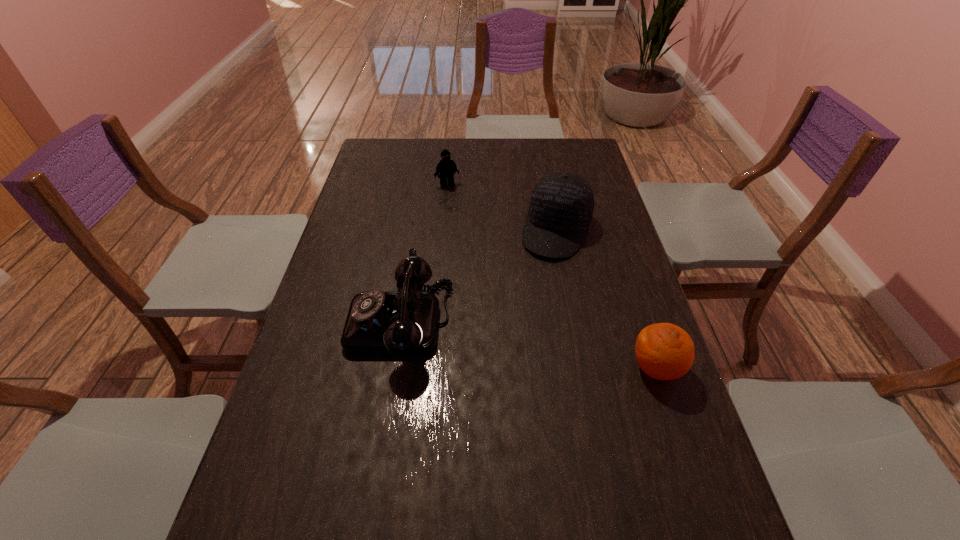
Locate an element on the screen. This screenshot has width=960, height=540. free spot at the far left corner of the desktop is located at coordinates (398, 168).

Image resolution: width=960 pixels, height=540 pixels. In order to click on vacant region at the far right corner in this screenshot , I will do `click(560, 166)`.

This screenshot has width=960, height=540. Identify the location of empty space that is in between the telephone and the farthest object. (423, 253).

The width and height of the screenshot is (960, 540). I want to click on empty space that is in between the baseball cap and the orange, so click(607, 299).

Locate an element on the screen. empty space between the baseball cap and the farthest object is located at coordinates (502, 207).

This screenshot has height=540, width=960. In order to click on vacant space that is in between the Lego and the baseball cap in this screenshot , I will do [x=502, y=207].

The image size is (960, 540). In order to click on empty location between the orange and the telephone in this screenshot , I will do `click(528, 345)`.

Where is `free space between the orange and the farthest object`? The image size is (960, 540). free space between the orange and the farthest object is located at coordinates (552, 276).

You are a GUI agent. You are given a task and a screenshot of the screen. Output one action in this format:
    pyautogui.click(x=<x>, y=<y>)
    Task: Click on the unoccupied area between the telephone and the baseball cap
    
    Given the screenshot: What is the action you would take?
    pyautogui.click(x=478, y=276)

Find the location of a particular element. The height and width of the screenshot is (540, 960). free space between the orange and the telephone is located at coordinates (528, 345).